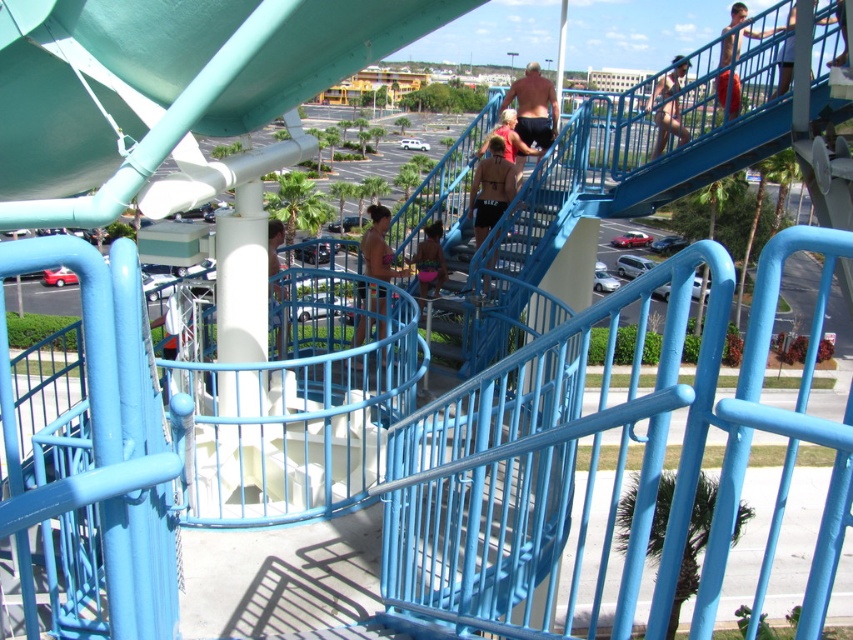
Question: Which point is closer to the camera taking this photo?

Choices:
 (A) (440, 244)
 (B) (508, 154)
 (C) (523, 104)

Answer: (A)

Question: Does smooth tan skin at upper right appear on the left side of matte pink shorts at center?

Choices:
 (A) no
 (B) yes

Answer: (A)

Question: Is red cotton shorts at upper right smaller than smooth tan skin at upper right?

Choices:
 (A) no
 (B) yes

Answer: (A)

Question: Which object is closer to the camera taking this photo?

Choices:
 (A) brown leather jacket at center
 (B) blue metallic stairs at upper center
 (C) matte pink shorts at center
 (D) shiny black shorts at upper center

Answer: (B)

Question: Which of the following is the farthest from the observer?

Choices:
 (A) brown leather jacket at center
 (B) shiny black shorts at upper center
 (C) matte pink shorts at center
 (D) blue metallic stairs at upper center

Answer: (B)

Question: Is shiny black shorts at upper center to the right of matte brown hair at center from the viewer's perspective?

Choices:
 (A) yes
 (B) no

Answer: (A)